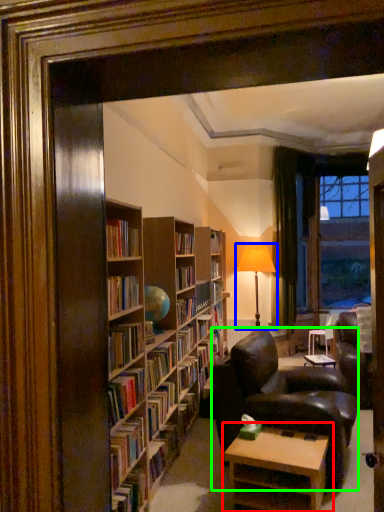
Question: Which object is positioned closest to table (highlighted by a red box)? Select from table lamp (highlighted by a blue box) and chair (highlighted by a green box).

Choices:
 (A) table lamp
 (B) chair

Answer: (B)